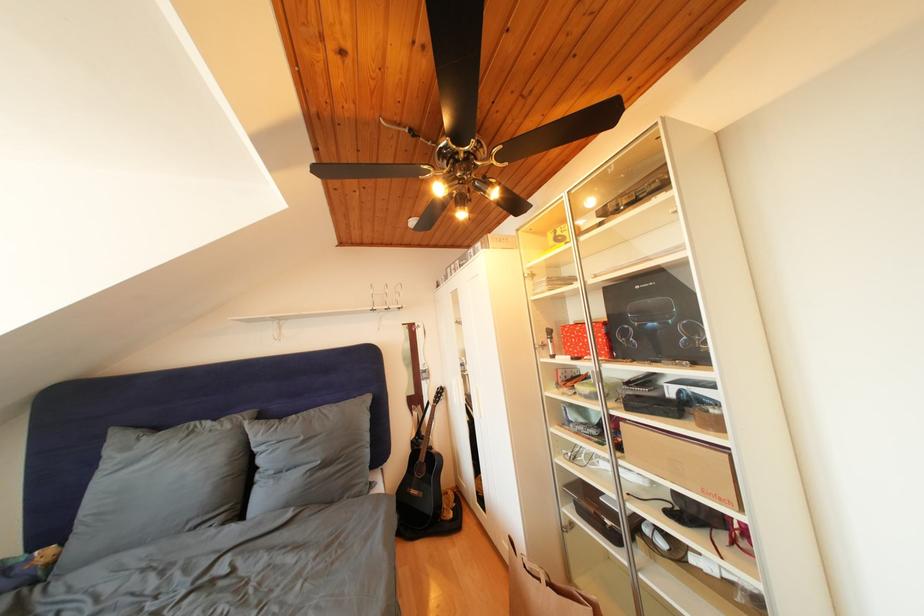
The image size is (924, 616). Identify the location of white cabinet handle. (608, 591).